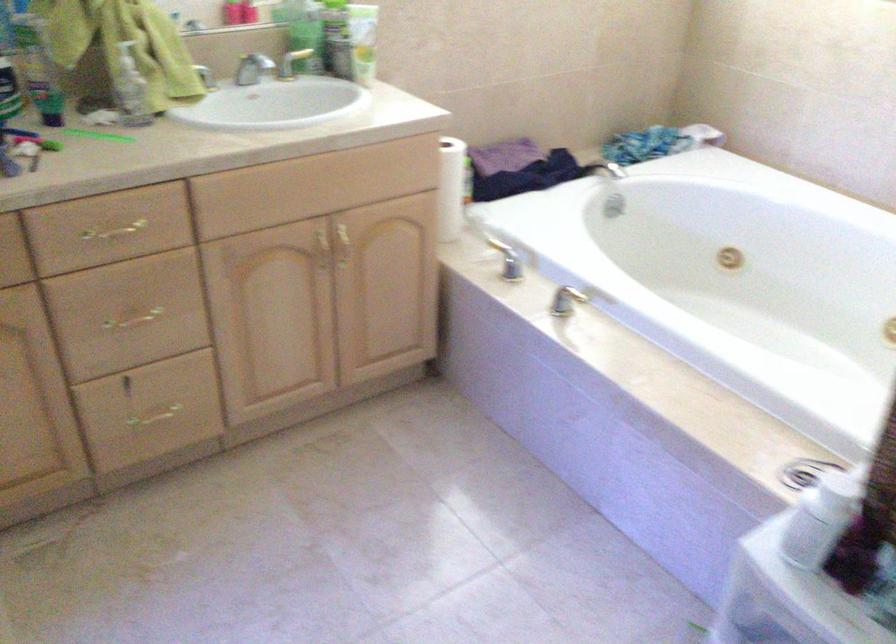
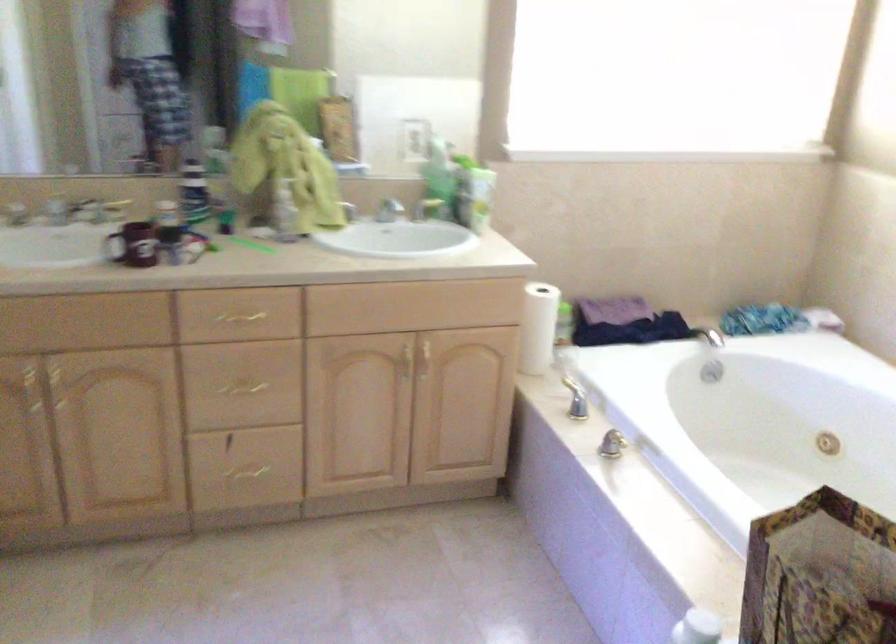
Question: I am providing you with two images of the same scene from different viewpoints. Please identify which objects are invisible in image2.

Choices:
 (A) bathtub faucet handle
 (B) red mug handle
 (C) soap pump
 (D) none of these

Answer: (D)